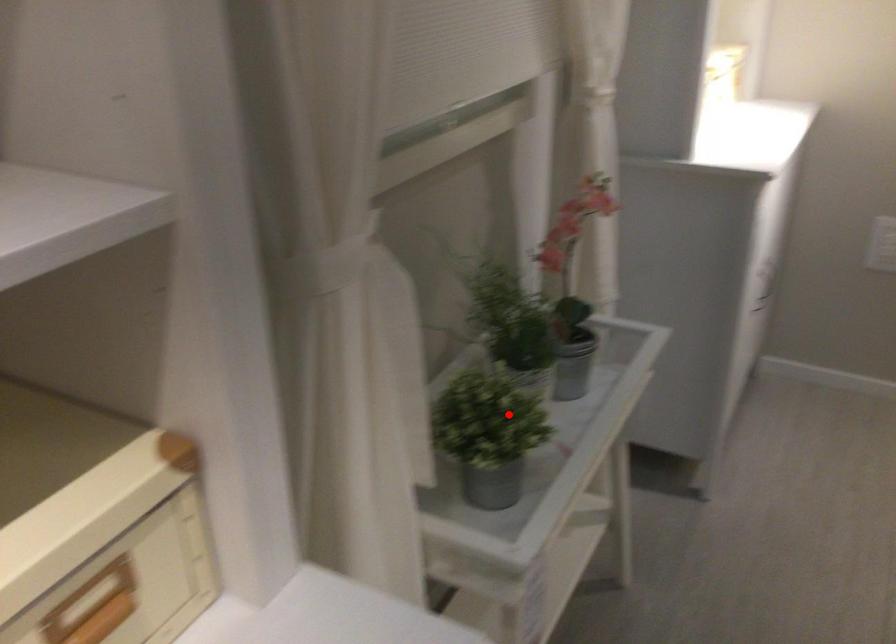
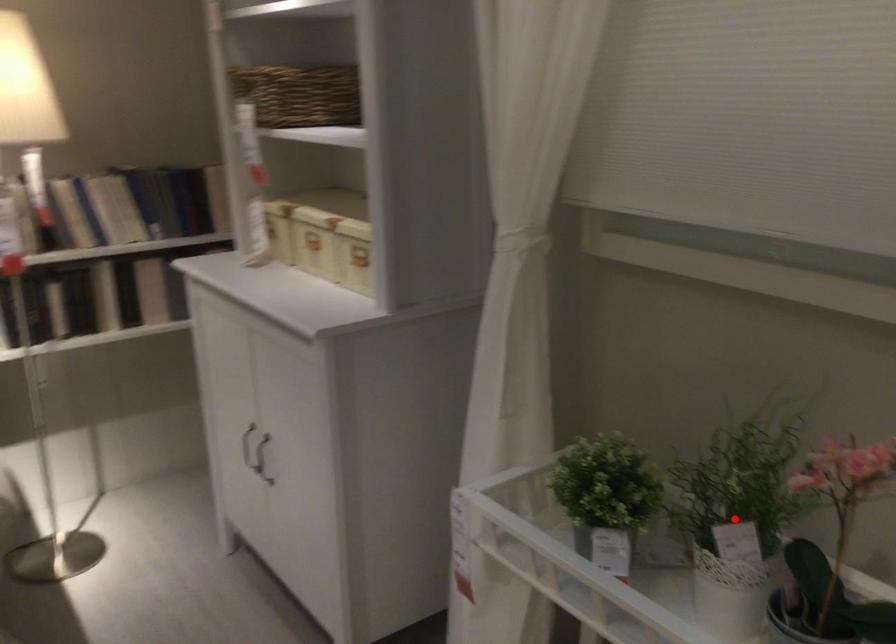
I am providing you with two images of the same scene from different viewpoints. A red point is marked on the first image and another point is marked on the second image. Are the points marked in image1 and image2 representing the same 3D position?

No